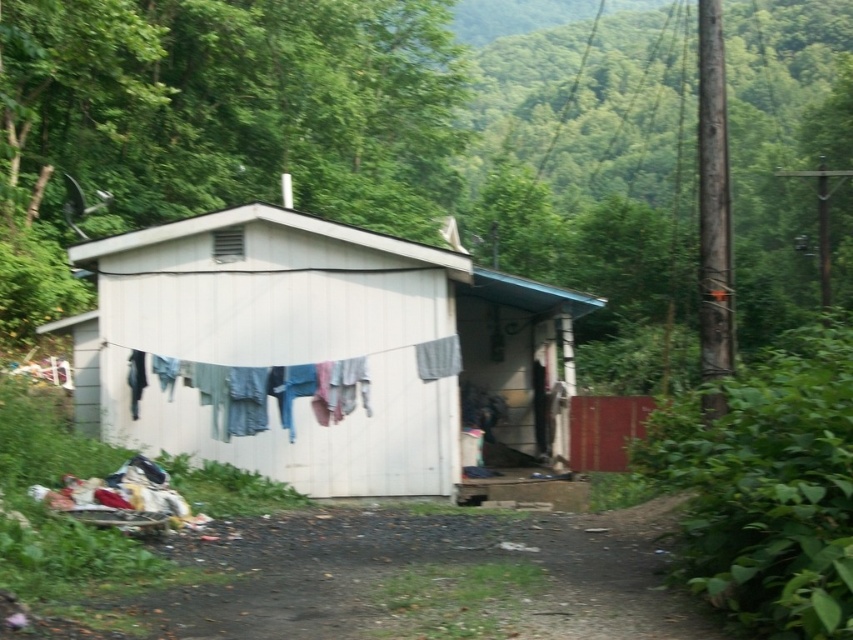
Question: In this image, where is white corrugated metal hut at center located relative to washed cotton clothes at center?

Choices:
 (A) above
 (B) below

Answer: (B)

Question: Where is white corrugated metal hut at center located in relation to washed cotton clothes at center in the image?

Choices:
 (A) above
 (B) below

Answer: (B)

Question: Does white corrugated metal hut at center have a greater width compared to washed cotton clothes at center?

Choices:
 (A) no
 (B) yes

Answer: (A)